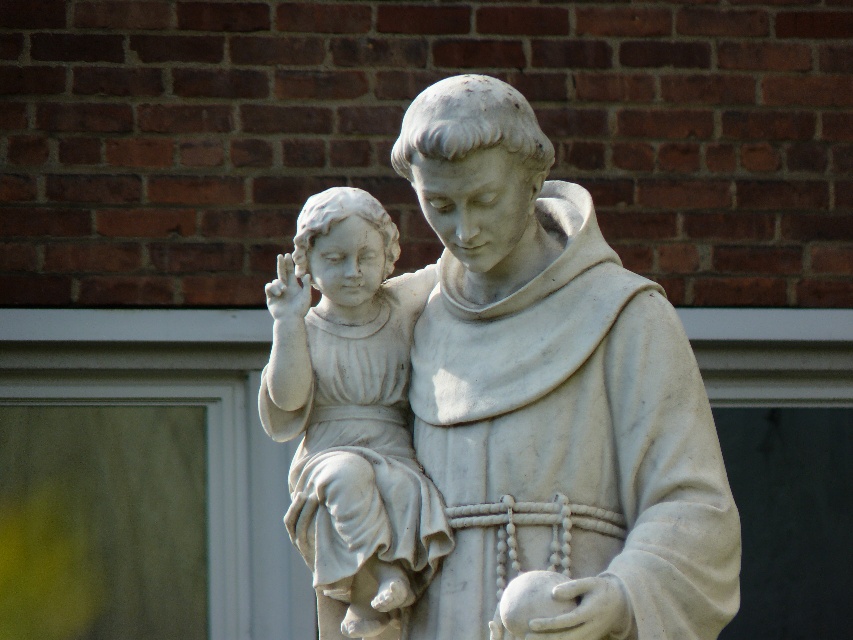
This screenshot has width=853, height=640. What do you see at coordinates (553, 392) in the screenshot? I see `white marble statue at center` at bounding box center [553, 392].

Locate an element on the screen. This screenshot has width=853, height=640. white marble statue at center is located at coordinates (553, 392).

The height and width of the screenshot is (640, 853). Identify the location of white marble statue at center. (553, 392).